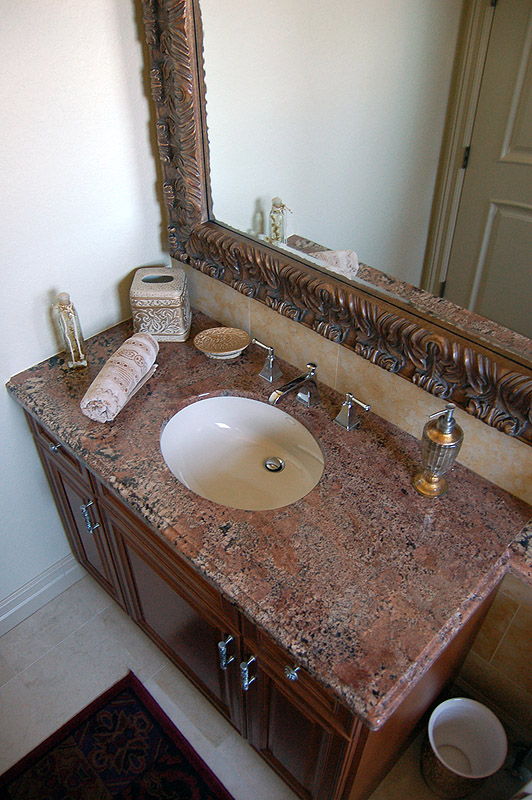
This screenshot has height=800, width=532. Find the location of `dark granite bathroom counter top`. dark granite bathroom counter top is located at coordinates (331, 609).